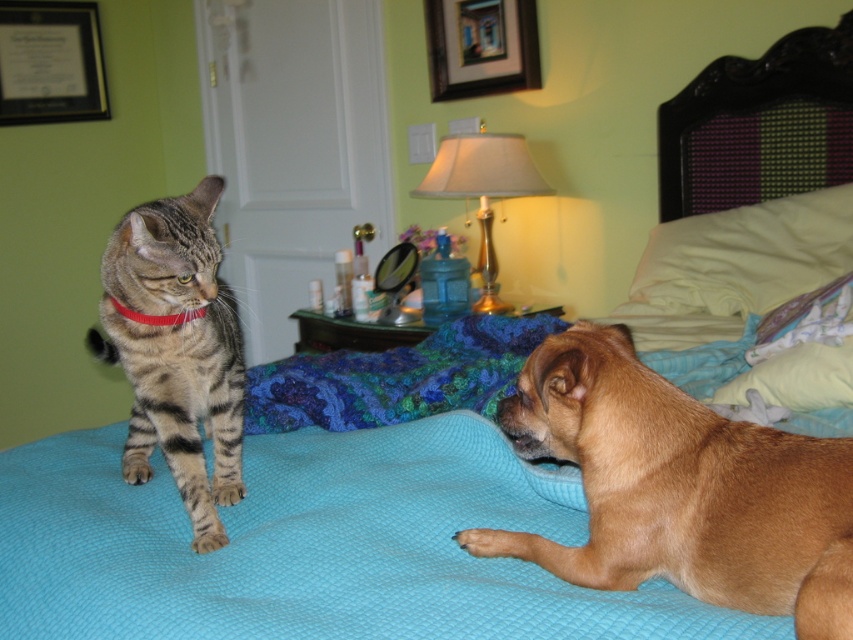
Question: Can you confirm if brown furry dog at lower right is positioned below white soft pillow at upper right?

Choices:
 (A) no
 (B) yes

Answer: (B)

Question: Is knitted wool blanket at center to the left of gold metallic lampshade at upper center from the viewer's perspective?

Choices:
 (A) yes
 (B) no

Answer: (B)

Question: In this image, where is brown furry dog at lower right located relative to red fabric collar at upper left?

Choices:
 (A) right
 (B) left

Answer: (A)

Question: Which point is closer to the camera taking this photo?

Choices:
 (A) (527, 20)
 (B) (662, 262)

Answer: (B)

Question: Which of the following is the closest to the observer?

Choices:
 (A) (480, 83)
 (B) (418, 371)
 (C) (161, 346)

Answer: (C)

Question: Which object is farther from the camera taking this photo?

Choices:
 (A) tabby fur cat at left
 (B) brown furry dog at lower right
 (C) matte black frame at upper left
 (D) white soft pillow at upper right

Answer: (C)